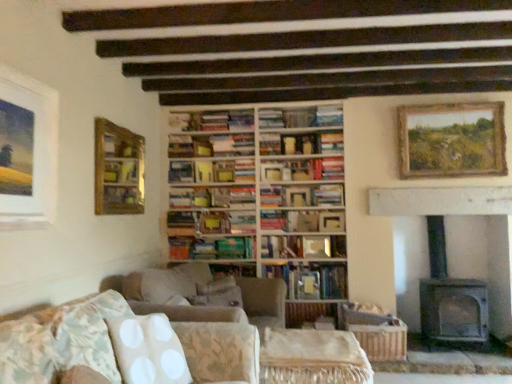
At what (x,y) coordinates should I click in order to perform the action: click on free location above hardcover books at center, placed as the first book when sorted from top to bottom (from a real-world perspective). Please return your answer as a coordinate pair (x, y). Looking at the image, I should click on point(225,110).